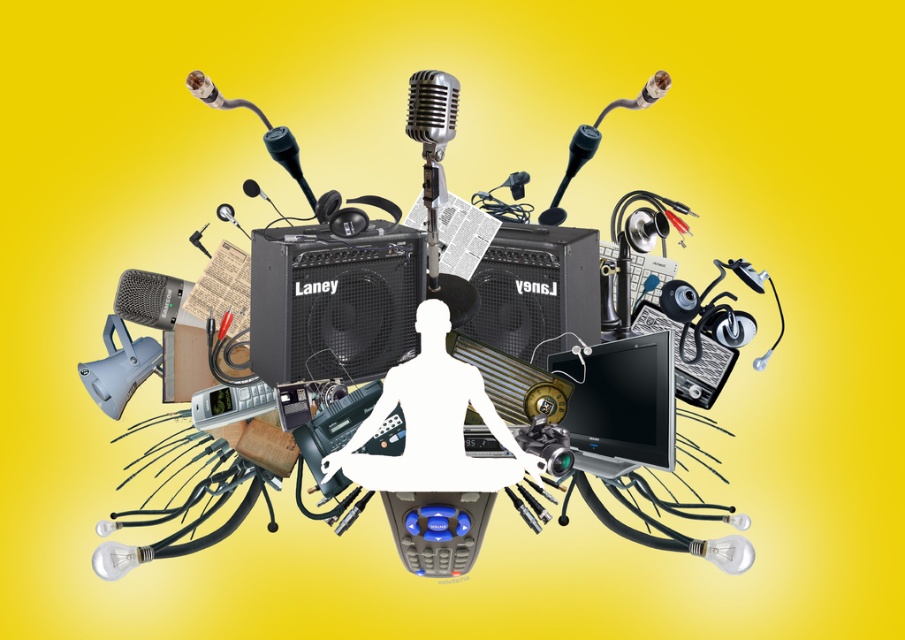
You are a sound technician who needs to adjust the shiny silver microphone at center. If your arm can reach up to 1.2 meters, can you reach it without moving your position?

The shiny silver microphone at center is 1.35 meters away from the viewer. Since your arm can only reach up to 1.2 meters, you cannot reach the shiny silver microphone at center without moving closer.

You are setting up a stage for a live event and need to ensure that the black glossy monitor at center and the metallic black microphone at center are visible to the audience. Given their sizes, which one will likely require a higher position to be seen clearly?

The black glossy monitor at center is much taller than the metallic black microphone at center, so it will likely require a higher position to be seen clearly by the audience.

You are setting up a stage for a live event and need to place the shiny silver microphone at center and the black matte microphone at center. Based on their sizes, which microphone should be positioned closer to the front of the stage to ensure visibility?

The shiny silver microphone at center is much taller than the black matte microphone at center, so positioning the black matte microphone at center closer to the front would ensure better visibility as it is shorter and less likely to block the view.